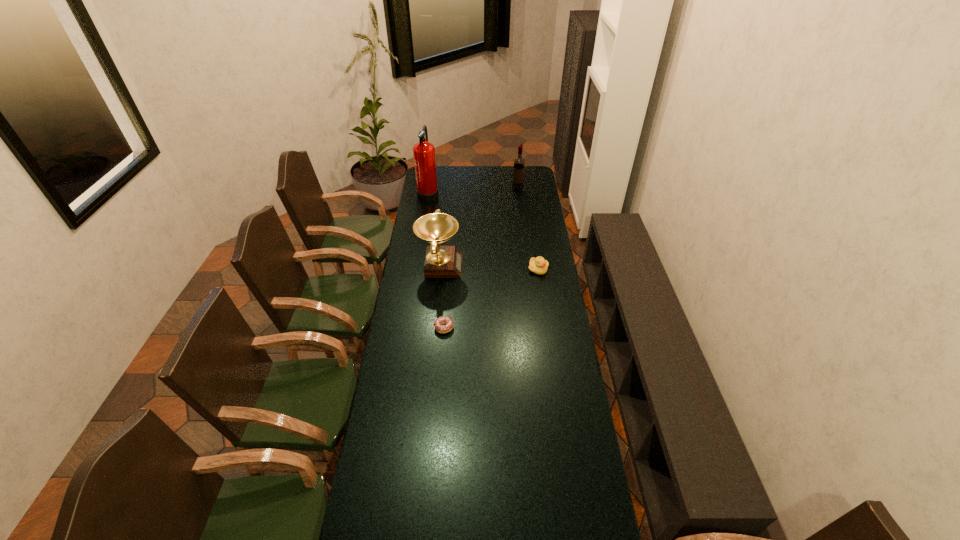
Locate an element on the screen. The image size is (960, 540). vacant region located on the left of the nearest object is located at coordinates (420, 328).

At what (x,y) coordinates should I click in order to perform the action: click on object that is at the far edge. Please return your answer as a coordinate pair (x, y). This screenshot has height=540, width=960. Looking at the image, I should click on (423, 152).

Locate an element on the screen. fire extinguisher at the left edge is located at coordinates (423, 152).

Identify the location of award positioned at the left edge. (440, 261).

Where is `wine bottle located at the right edge`? wine bottle located at the right edge is located at coordinates (519, 163).

Locate an element on the screen. The image size is (960, 540). duckling located in the right edge section of the desktop is located at coordinates (538, 265).

Where is `object at the far left corner`? object at the far left corner is located at coordinates (423, 152).

Find the location of a particular element. This screenshot has height=540, width=960. vacant region at the left edge of the desktop is located at coordinates 411,427.

In the image, there is a desktop. At what (x,y) coordinates should I click in order to perform the action: click on vacant space at the right edge. Please return your answer as a coordinate pair (x, y). Looking at the image, I should click on (546, 490).

The image size is (960, 540). I want to click on free space between the tallest object and the wine bottle, so click(x=473, y=191).